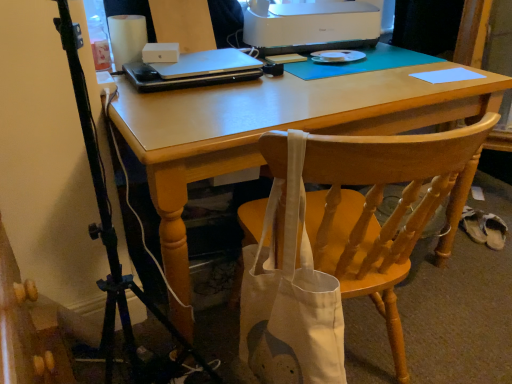
Question: From the image's perspective, relative to light blue paper at upper right, is wooden chair at center above or below?

Choices:
 (A) below
 (B) above

Answer: (A)

Question: Do you think wooden chair at center is within light blue paper at upper right, or outside of it?

Choices:
 (A) outside
 (B) inside

Answer: (A)

Question: Estimate the real-world distances between objects in this image. Which object is farther from the white fabric shoe at lower right?

Choices:
 (A) matte wooden desk at center
 (B) sleek silver laptop at center
 (C) light blue paper at upper right
 (D) wooden chair at center
 (E) white plastic printer at upper center

Answer: (B)

Question: Estimate the real-world distances between objects in this image. Which object is farther from the white fabric shoe at lower right?

Choices:
 (A) wooden chair at center
 (B) light blue paper at upper right
 (C) matte wooden desk at center
 (D) white plastic printer at upper center
 (E) sleek silver laptop at center

Answer: (E)